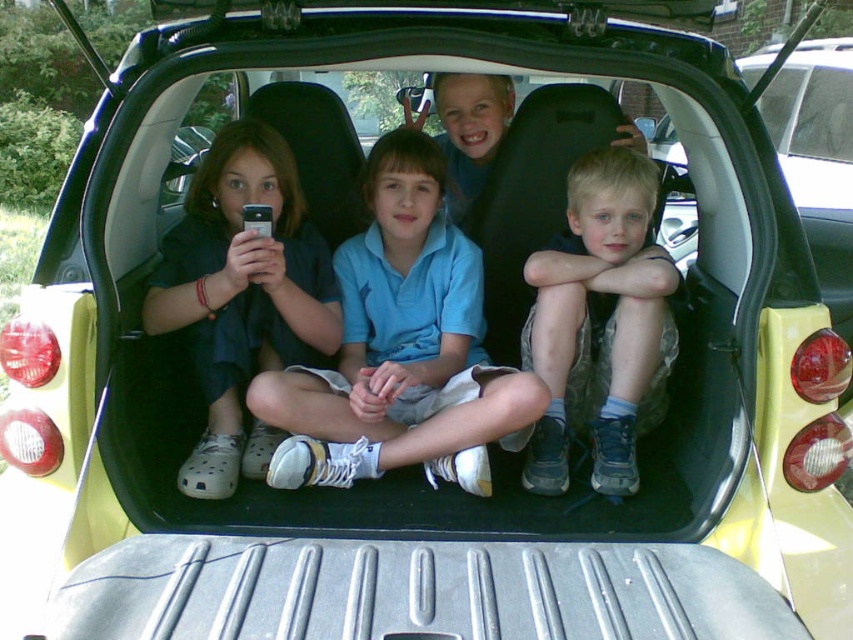
Question: Does blue cotton shirt at center appear under blue fabric shorts at center?

Choices:
 (A) yes
 (B) no

Answer: (B)

Question: Among these objects, which one is farthest from the camera?

Choices:
 (A) blue cotton shirt at center
 (B) blue fabric shorts at center

Answer: (B)

Question: Is blue cotton shirt at center wider than matte black shirt at center?

Choices:
 (A) yes
 (B) no

Answer: (A)

Question: Is blue cotton shirt at center further to the viewer compared to blue fabric shorts at center?

Choices:
 (A) no
 (B) yes

Answer: (A)

Question: Which object appears closest to the camera in this image?

Choices:
 (A) blue fabric shorts at center
 (B) blue cotton shirt at center
 (C) matte black shirt at center

Answer: (B)

Question: Which point is farther from the camera taking this photo?

Choices:
 (A) click(422, 385)
 (B) click(297, 307)
 (C) click(602, 412)

Answer: (A)